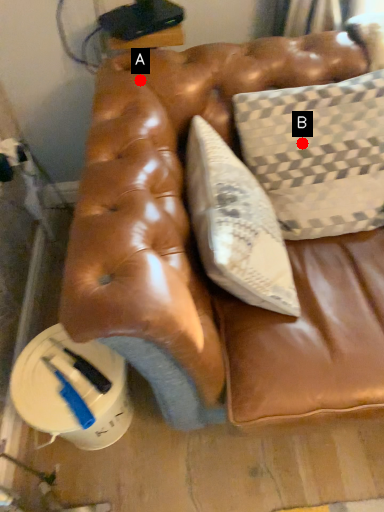
Question: Two points are circled on the image, labeled by A and B beside each circle. Which point is farther to the camera?

Choices:
 (A) A is further
 (B) B is further

Answer: (B)